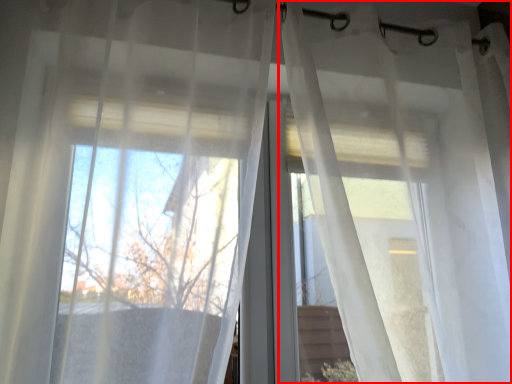
Question: Where is curtain (annotated by the red box) located in relation to curtain in the image?

Choices:
 (A) left
 (B) right

Answer: (B)